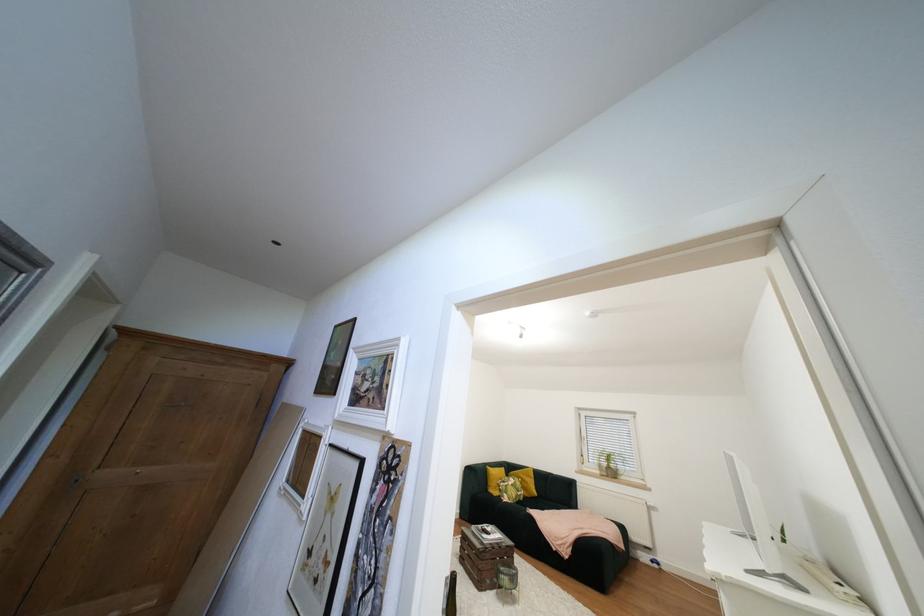
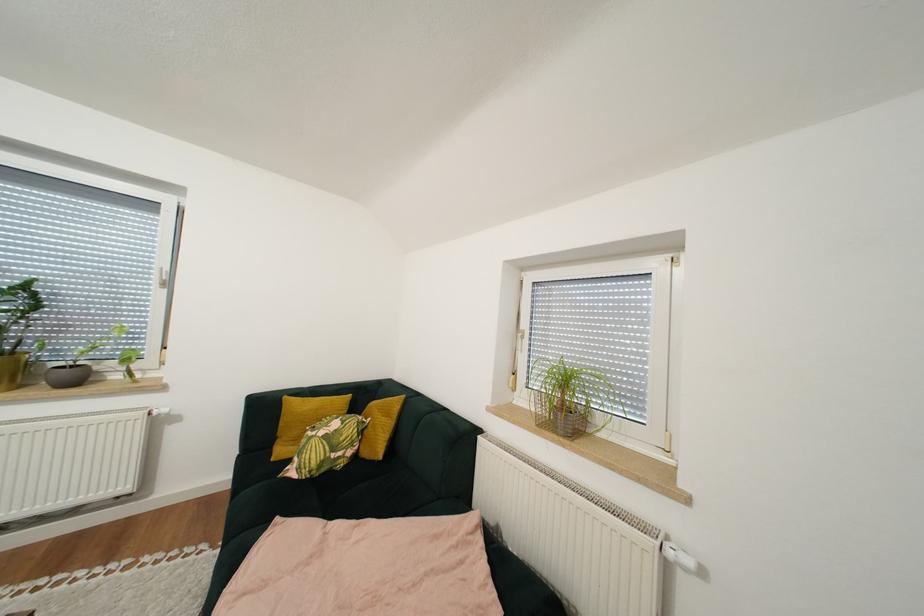
In a continuous first-person perspective shot, in which direction is the camera moving?

The cameraman walked toward right, forward.